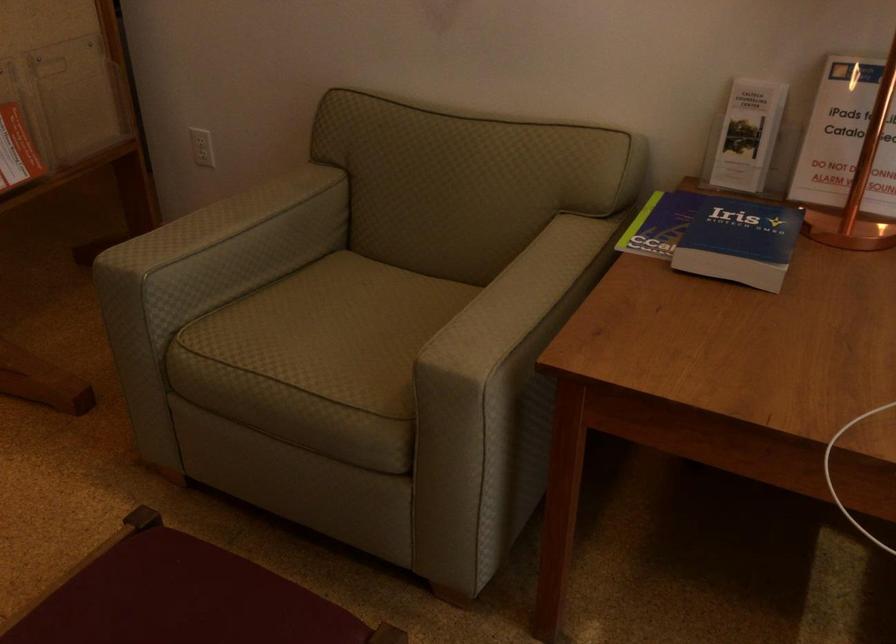
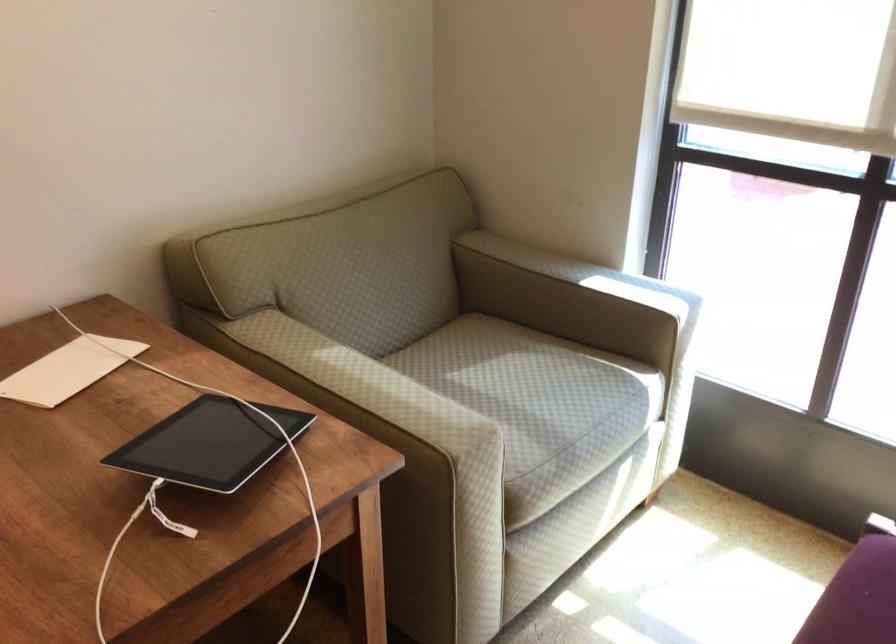
How did the camera likely rotate?

The camera's rotation is toward right-down.